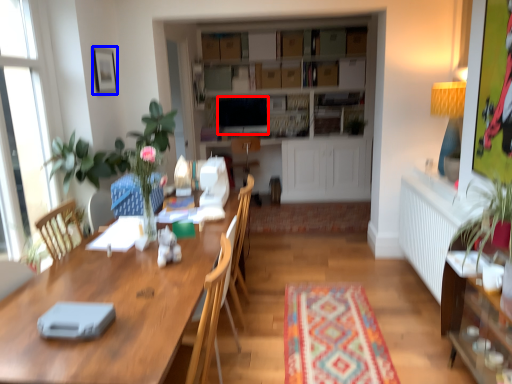
Question: Which object is further to the camera taking this photo, television (highlighted by a red box) or picture frame (highlighted by a blue box)?

Choices:
 (A) television
 (B) picture frame

Answer: (A)